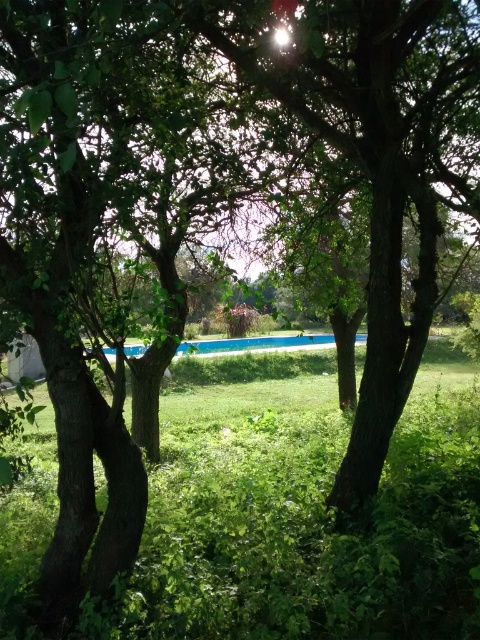
Can you confirm if green leafy grass at center is positioned above blue smooth pool at center?

Actually, green leafy grass at center is below blue smooth pool at center.

Can you confirm if green leafy grass at center is wider than blue smooth pool at center?

No, green leafy grass at center is not wider than blue smooth pool at center.

What do you see at coordinates (300, 524) in the screenshot? This screenshot has width=480, height=640. I see `green leafy grass at center` at bounding box center [300, 524].

Find the location of `green leafy grass at center`. green leafy grass at center is located at coordinates (300, 524).